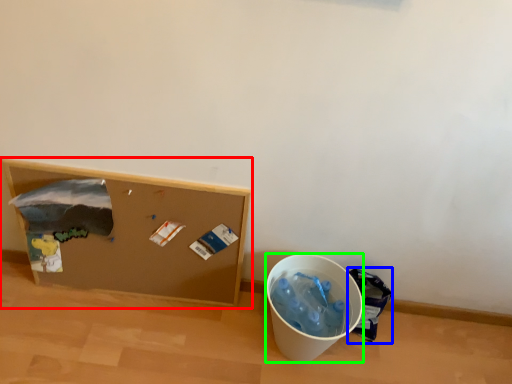
Question: Which object is positioned farthest from furniture (highlighted by a red box)? Select from garbage (highlighted by a blue box) and recycling bin (highlighted by a green box).

Choices:
 (A) garbage
 (B) recycling bin

Answer: (A)